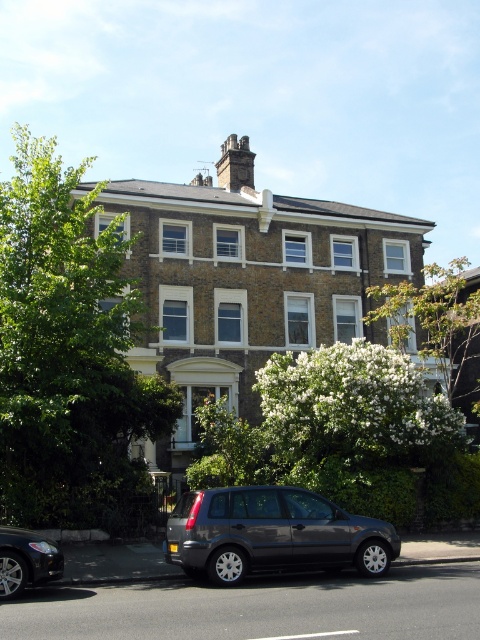
You are standing in front of the residential building and notice two trees. The green leafy tree at left and the white blossoming tree at upper right. Which tree appears higher up in the image?

The green leafy tree at left is located above the white blossoming tree at upper right, so it appears higher up in the image.

You are a window cleaner standing on the ground in front of the residential building. You need to clean the windows on the third floor. Which object, the white blossoming tree at upper right or the dark gray stone chimney at upper center, is closer to the third floor windows?

The white blossoming tree at upper right is much taller than the dark gray stone chimney at upper center, so the tree is closer to the third floor windows.

You are a visitor arriving at the residential building and need to park your car, which is 1.8 meters tall. The parking space is located near the green leafy tree at left and the dark gray metallic car at lower left. Can your car fit under the tree without hitting its branches?

The green leafy tree at left is taller than the dark gray metallic car at lower left. Since the tree is taller than the car, it might have lower branches that could hit the car. To ensure safety, park the car away from the tree or check the tree height before parking.